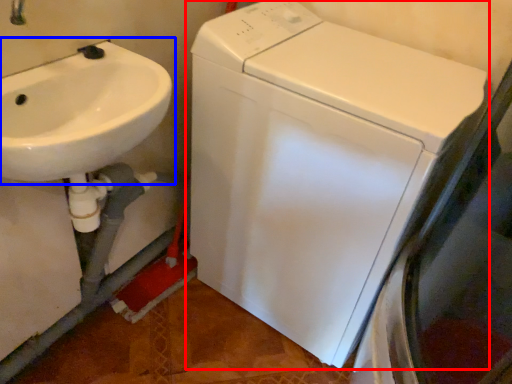
Question: Which of the following is the closest to the observer, washing machine (highlighted by a red box) or sink (highlighted by a blue box)?

Choices:
 (A) washing machine
 (B) sink

Answer: (B)